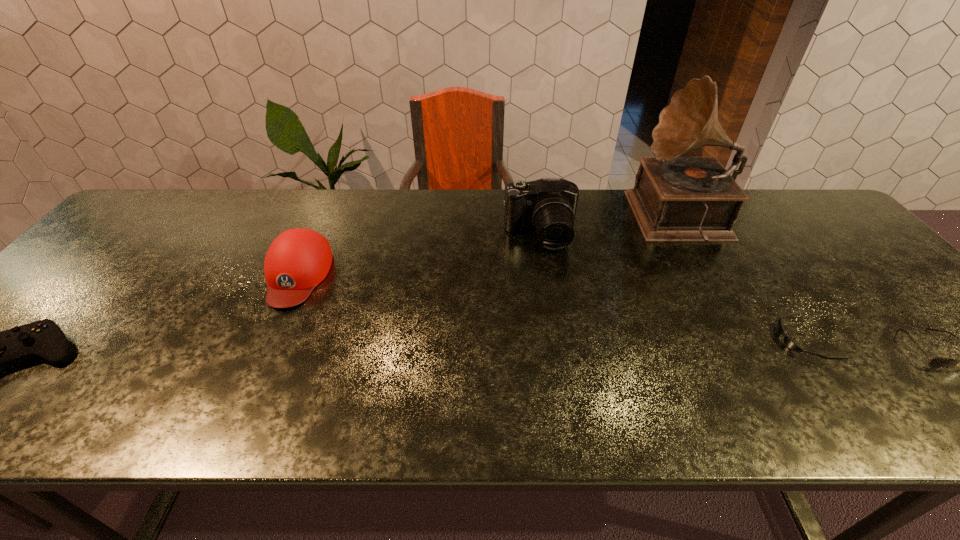
The height and width of the screenshot is (540, 960). Find the location of `the tallest object`. the tallest object is located at coordinates (675, 198).

Locate an element on the screen. The width and height of the screenshot is (960, 540). the second tallest object is located at coordinates (548, 205).

This screenshot has height=540, width=960. What are the coordinates of `camera` in the screenshot? It's located at (548, 205).

You are a GUI agent. You are given a task and a screenshot of the screen. Output one action in this format:
    pyautogui.click(x=<x>, y=<y>)
    Task: Click on the fourth shortest object
    This screenshot has height=540, width=960.
    Given the screenshot: What is the action you would take?
    pyautogui.click(x=299, y=259)

You are a GUI agent. You are given a task and a screenshot of the screen. Output one action in this format:
    pyautogui.click(x=<x>, y=<y>)
    Task: Click on the second object from left to right
    This screenshot has width=960, height=540.
    Given the screenshot: What is the action you would take?
    pyautogui.click(x=299, y=259)

The height and width of the screenshot is (540, 960). I want to click on the shortest object, so click(x=789, y=343).

The image size is (960, 540). Find the location of `the left sunglasses`. the left sunglasses is located at coordinates pos(789,343).

Locate an element on the screen. Image resolution: width=960 pixels, height=540 pixels. vacant space located from the horn of the record player is located at coordinates (613, 220).

What are the coordinates of `vacant space situated from the horn of the record player` in the screenshot? It's located at (543, 220).

The image size is (960, 540). In order to click on free region located 0.200m from the horn of the record player in this screenshot , I will do `click(570, 220)`.